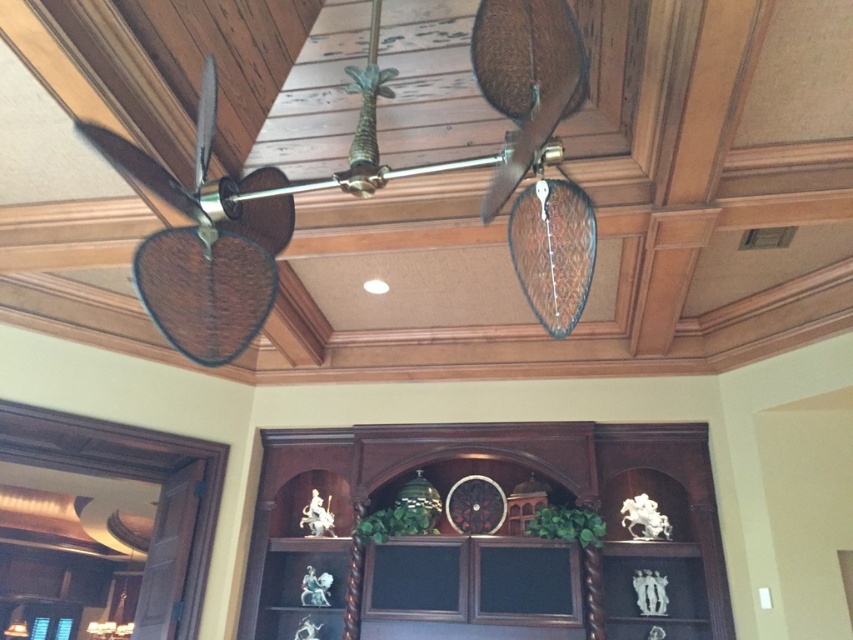
Question: Is brown woven fan at left smaller than rattan/wooden ceiling fan at upper center?

Choices:
 (A) no
 (B) yes

Answer: (B)

Question: Does brown woven fan at left have a larger size compared to rattan/wooden ceiling fan at upper center?

Choices:
 (A) no
 (B) yes

Answer: (A)

Question: Which point is farther from the camera taking this photo?

Choices:
 (A) (199, 138)
 (B) (279, 209)

Answer: (B)

Question: Which of the following is the closest to the observer?

Choices:
 (A) brown woven fan at left
 (B) rattan/wooden ceiling fan at upper center

Answer: (B)

Question: Which object appears farthest from the camera in this image?

Choices:
 (A) rattan/wooden ceiling fan at upper center
 (B) brown woven fan at left

Answer: (B)

Question: Observing the image, what is the correct spatial positioning of brown woven fan at left in reference to rattan/wooden ceiling fan at upper center?

Choices:
 (A) below
 (B) above

Answer: (A)